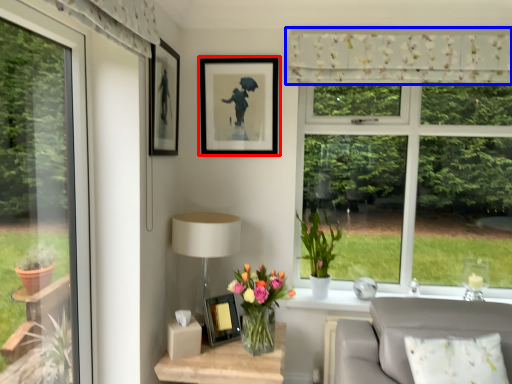
Question: Which point is closer to the camera, picture frame (highlighted by a red box) or curtain (highlighted by a blue box)?

Choices:
 (A) picture frame
 (B) curtain

Answer: (B)